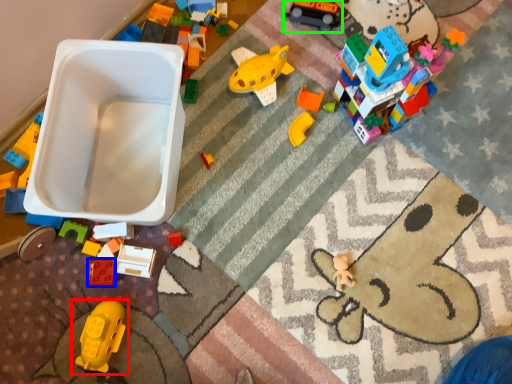
Question: Based on their relative distances, which object is farther from toy (highlighted by a red box)? Choose from toy (highlighted by a blue box) and toy (highlighted by a green box).

Choices:
 (A) toy
 (B) toy

Answer: (B)